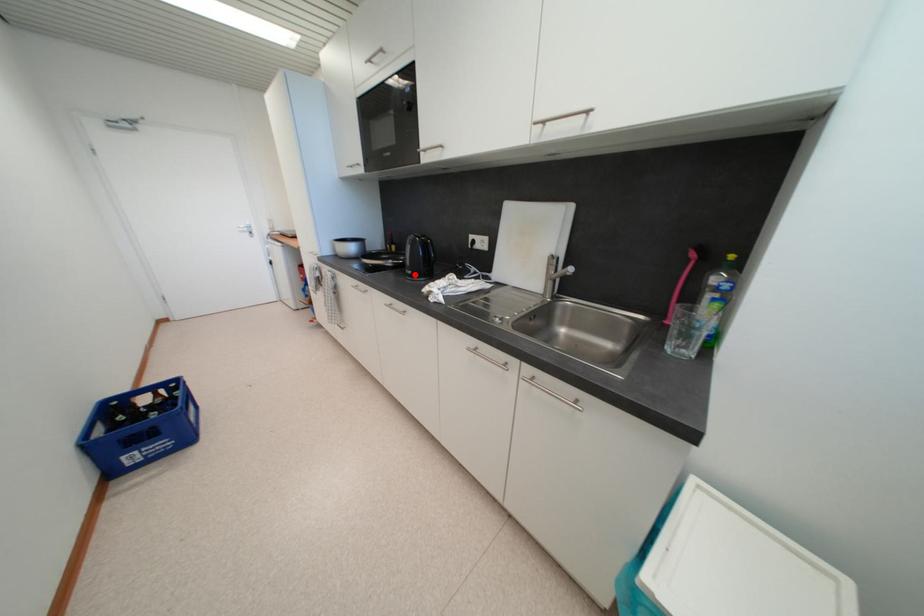
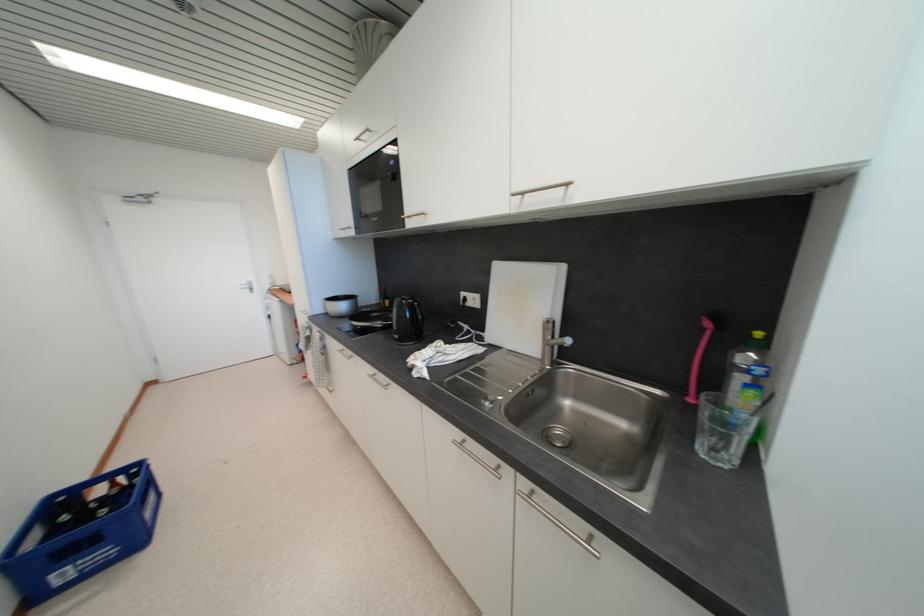
Locate, in the second image, the point that corresponds to the highlighted location in the first image.

(402, 339)